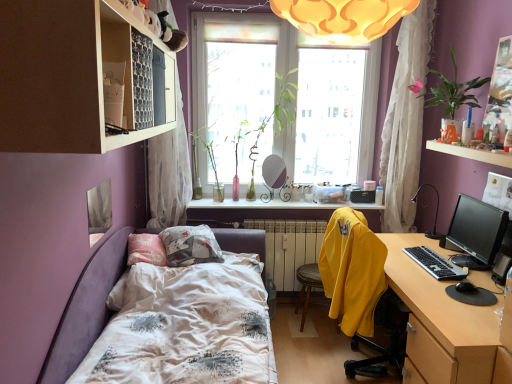
Locate an element on the screen. vacant area that lies to the right of black plastic keyboard at right is located at coordinates (461, 257).